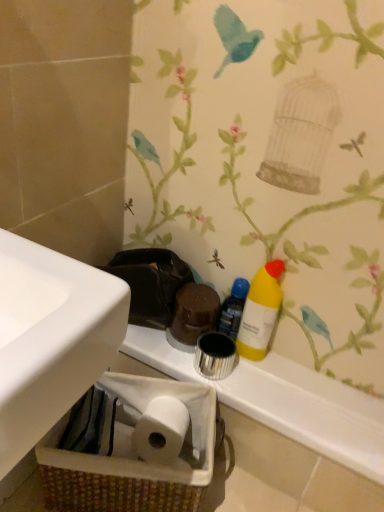
Where is `vacant space to the right of yellow matte bottle at right`? This screenshot has height=512, width=384. vacant space to the right of yellow matte bottle at right is located at coordinates (x=304, y=373).